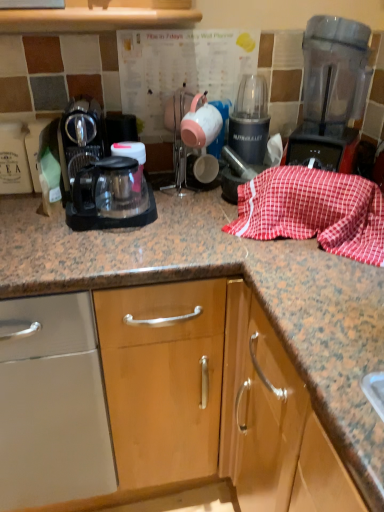
Question: In the image, is black plastic coffee maker at left positioned in front of or behind black plastic blender at center?

Choices:
 (A) front
 (B) behind

Answer: (A)

Question: From the image's perspective, is black plastic coffee maker at left above or below black plastic blender at center?

Choices:
 (A) above
 (B) below

Answer: (B)

Question: Which object is positioned farthest from the black plastic blender at center?

Choices:
 (A) black plastic coffee maker at left
 (B) transparent plastic blender at upper right
 (C) red checkered cloth at center
 (D) matte ceramic tea pot at center

Answer: (A)

Question: Estimate the real-world distances between objects in this image. Which object is closer to the red checkered cloth at center?

Choices:
 (A) matte ceramic tea pot at center
 (B) black plastic blender at center
 (C) transparent plastic blender at upper right
 (D) black plastic coffee maker at left

Answer: (C)